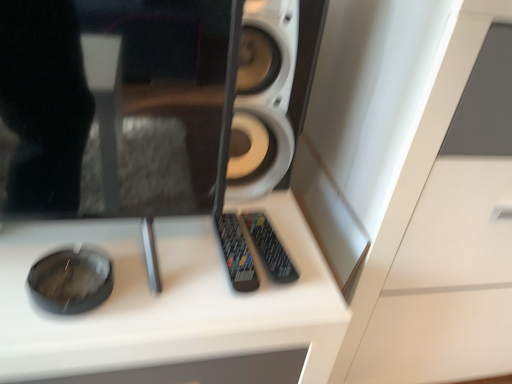
Question: Is black plastic remote at center, which is the second control from right to left, positioned with its back to white glossy dresser at center?

Choices:
 (A) no
 (B) yes

Answer: (A)

Question: Considering the relative sizes of black plastic remote at center, arranged as the first control when viewed from the left, and white glossy dresser at center in the image provided, is black plastic remote at center, arranged as the first control when viewed from the left, taller than white glossy dresser at center?

Choices:
 (A) no
 (B) yes

Answer: (A)

Question: From the image's perspective, is black plastic remote at center, arranged as the first control when viewed from the left, above white glossy dresser at center?

Choices:
 (A) yes
 (B) no

Answer: (B)

Question: Could you tell me if black plastic remote at center, arranged as the first control when viewed from the left, is turned towards white glossy dresser at center?

Choices:
 (A) yes
 (B) no

Answer: (B)

Question: From the image's perspective, is black plastic remote at center, which is the second control from right to left, under white glossy dresser at center?

Choices:
 (A) yes
 (B) no

Answer: (A)

Question: Is black plastic remote at center, which is the second control from right to left, in contact with white glossy dresser at center?

Choices:
 (A) yes
 (B) no

Answer: (B)

Question: Is white glossy dresser at center smaller than black plastic remote at center, arranged as the first control when viewed from the left?

Choices:
 (A) no
 (B) yes

Answer: (A)

Question: Is white glossy dresser at center aimed at black plastic remote at center, arranged as the first control when viewed from the left?

Choices:
 (A) yes
 (B) no

Answer: (B)

Question: From a real-world perspective, is white glossy dresser at center physically above black plastic remote at center, arranged as the first control when viewed from the left?

Choices:
 (A) yes
 (B) no

Answer: (B)

Question: Can you confirm if white glossy dresser at center is thinner than black plastic remote at center, arranged as the first control when viewed from the left?

Choices:
 (A) no
 (B) yes

Answer: (A)

Question: Is white glossy dresser at center further to camera compared to black plastic remote at center, arranged as the first control when viewed from the left?

Choices:
 (A) no
 (B) yes

Answer: (A)

Question: From the image's perspective, is white glossy dresser at center beneath black plastic remote at center, which is the second control from right to left?

Choices:
 (A) no
 (B) yes

Answer: (A)

Question: From the image's perspective, is white matte speaker at center located beneath black plastic remote at center, arranged as the first control when viewed from the left?

Choices:
 (A) no
 (B) yes

Answer: (A)